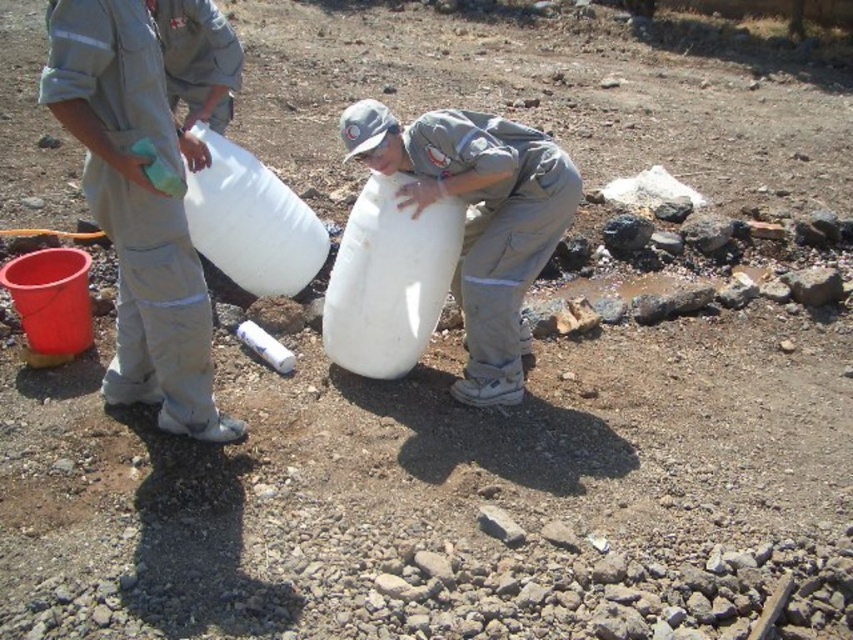
Based on the photo, between light gray uniform at left and white matte container at center, which one has less height?

Standing shorter between the two is white matte container at center.

Does light gray uniform at left have a lesser height compared to white matte container at center?

In fact, light gray uniform at left may be taller than white matte container at center.

Measure the distance between point [177,424] and camera.

Point [177,424] is 10.64 feet from camera.

Image resolution: width=853 pixels, height=640 pixels. In order to click on light gray uniform at left in this screenshot , I will do `click(137, 208)`.